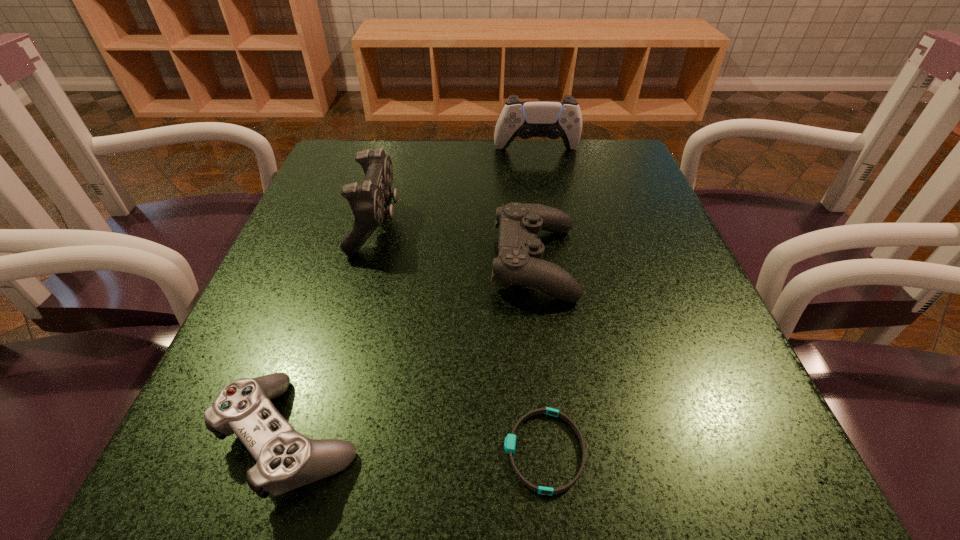
Locate an element on the screen. Image resolution: width=960 pixels, height=540 pixels. vacant space located on the buckle of the shortest object is located at coordinates (397, 451).

Identify the location of object that is at the far edge. (553, 119).

The height and width of the screenshot is (540, 960). I want to click on control present at the near edge, so click(286, 459).

The height and width of the screenshot is (540, 960). Identify the location of wristband situated at the near edge. (510, 441).

Identify the location of object located at the right edge. The image size is (960, 540). (553, 119).

The width and height of the screenshot is (960, 540). Find the location of `object situated at the near left corner`. object situated at the near left corner is located at coordinates (286, 459).

Identify the location of object that is positioned at the far right corner. The width and height of the screenshot is (960, 540). (553, 119).

In the image, there is a desktop. Where is `vacant space at the far edge`? This screenshot has height=540, width=960. vacant space at the far edge is located at coordinates (437, 166).

Identify the location of free space at the near edge of the desktop. (332, 501).

Where is `vacant space at the left edge`? The width and height of the screenshot is (960, 540). vacant space at the left edge is located at coordinates (262, 302).